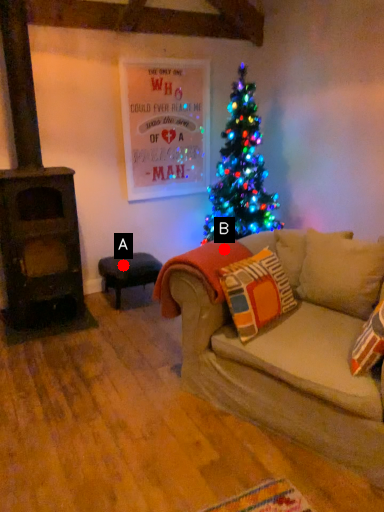
Question: Two points are circled on the image, labeled by A and B beside each circle. Among these points, which one is nearest to the camera?

Choices:
 (A) A is closer
 (B) B is closer

Answer: (B)